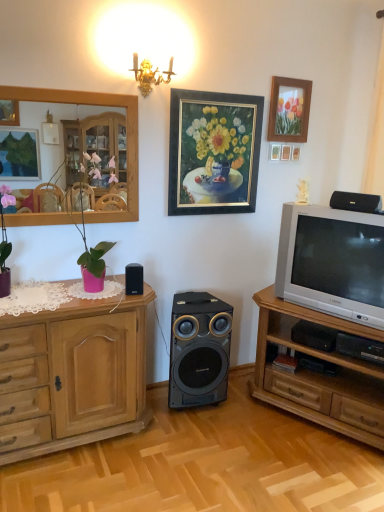
At what (x,y) coordinates should I click in order to perform the action: click on vacant area that is in front of wooden cabinet at left. Please return your answer as a coordinate pair (x, y). The image size is (384, 512). Looking at the image, I should click on (79, 480).